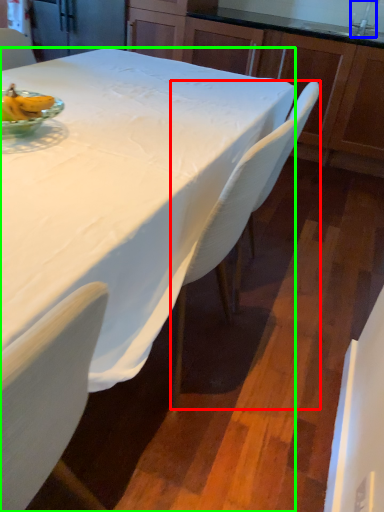
Question: Which object is positioned closest to chair (highlighted by a red box)? Select from faucet (highlighted by a blue box) and desk (highlighted by a green box).

Choices:
 (A) faucet
 (B) desk

Answer: (B)